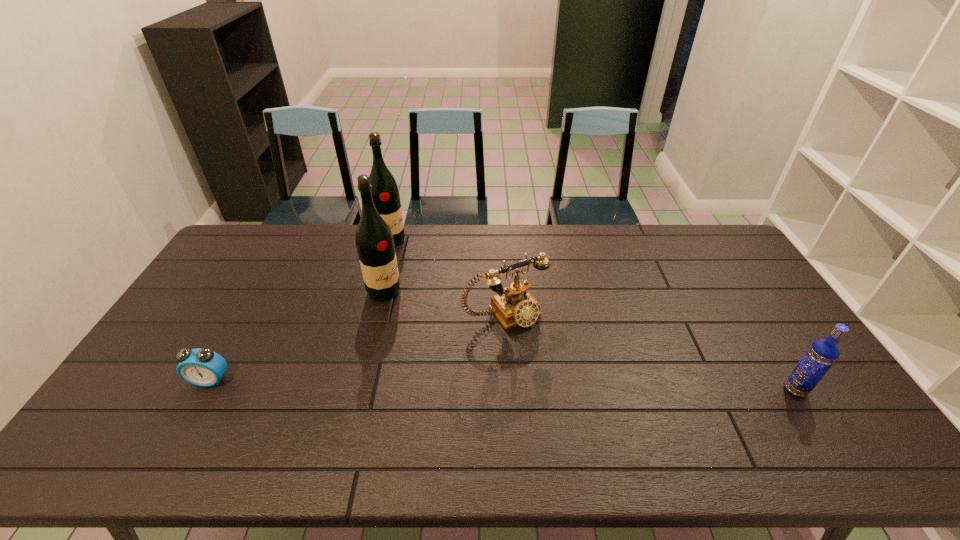
This screenshot has height=540, width=960. Identify the location of vacant space on the desktop that is between the alarm clock and the third tallest object and is positioned on the front-facing side of the nearer liquor. (550, 386).

At what (x,y) coordinates should I click in order to perform the action: click on free spot on the desktop that is between the leftmost object and the third tallest object and is positioned on the dial number of the second object from right to left. Please return your answer as a coordinate pair (x, y). The image size is (960, 540). Looking at the image, I should click on (562, 386).

This screenshot has height=540, width=960. Find the location of `free space on the desktop that is between the alarm clock and the vodka and is positioned on the front-facing side of the farther liquor`. free space on the desktop that is between the alarm clock and the vodka and is positioned on the front-facing side of the farther liquor is located at coordinates (507, 385).